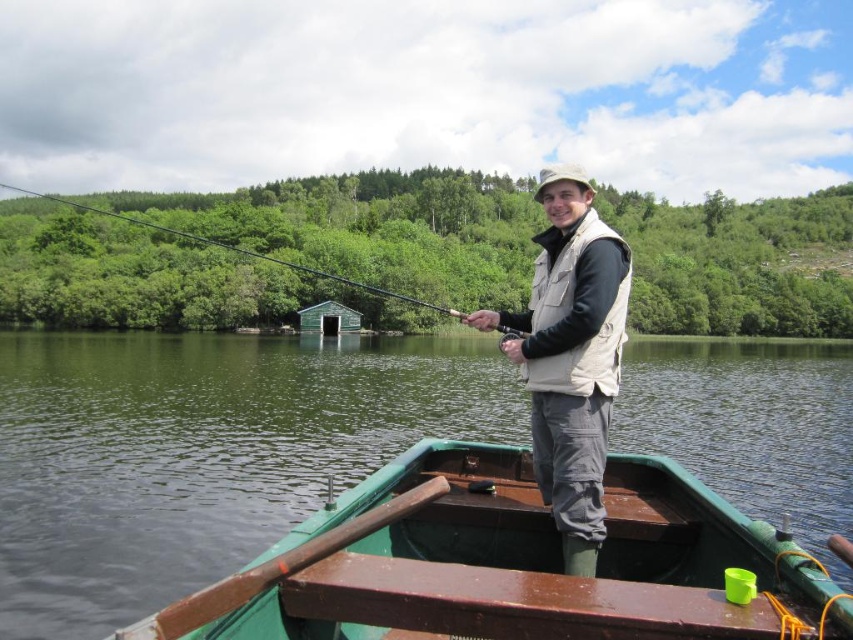
Is green wooden boat at center closer to camera compared to beige fabric vest at center?

No.

You are a GUI agent. You are given a task and a screenshot of the screen. Output one action in this format:
    pyautogui.click(x=<x>, y=<y>)
    Task: Click on the green wooden boat at center
    The image size is (853, 640).
    Given the screenshot: What is the action you would take?
    pyautogui.click(x=512, y=563)

Consider the image. Can you confirm if beige fabric vest at center is positioned to the left of green matte fishing pole at upper center?

No, beige fabric vest at center is not to the left of green matte fishing pole at upper center.

Does point (561, 499) lie behind point (265, 253)?

No, (561, 499) is closer to viewer.

Which is behind, point (525, 364) or point (140, 221)?

The point (140, 221) is behind.

This screenshot has height=640, width=853. In order to click on beige fabric vest at center in this screenshot , I will do `click(570, 356)`.

Which is in front, point (610, 513) or point (345, 284)?

Positioned in front is point (610, 513).

Which is behind, point (404, 472) or point (392, 296)?

Positioned behind is point (392, 296).

Who is more forward, (328, 600) or (143, 224)?

Point (328, 600)

The width and height of the screenshot is (853, 640). What are the coordinates of `green wooden boat at center` in the screenshot? It's located at (512, 563).